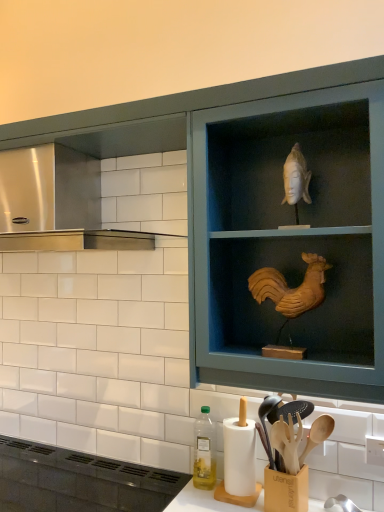
The width and height of the screenshot is (384, 512). What do you see at coordinates (80, 481) in the screenshot?
I see `matte black vent at lower left` at bounding box center [80, 481].

Where is `wooden spoons at lower center`? The height and width of the screenshot is (512, 384). wooden spoons at lower center is located at coordinates (291, 431).

Measure the distance between stainless steel vent at upper left and camera.

stainless steel vent at upper left and camera are 12.38 feet apart.

What do you see at coordinates (197, 180) in the screenshot? The height and width of the screenshot is (512, 384). I see `wooden cabinet at upper center` at bounding box center [197, 180].

You are a GUI agent. You are given a task and a screenshot of the screen. Output one action in this format:
    pyautogui.click(x=<x>, y=<y>)
    Task: Click on the translucent plastic bottle at lower center
    
    Given the screenshot: What is the action you would take?
    pyautogui.click(x=204, y=451)

Can you confirm if translucent plastic bottle at lower center is positioned to the right of wooden rooster at upper right?

Incorrect, translucent plastic bottle at lower center is not on the right side of wooden rooster at upper right.

In the scene shown: Which of these two, translucent plastic bottle at lower center or wooden rooster at upper right, is wider?

Wider between the two is wooden rooster at upper right.

Which is behind, translucent plastic bottle at lower center or wooden rooster at upper right?

translucent plastic bottle at lower center is further away from the camera.

How many degrees apart are the facing directions of translucent plastic bottle at lower center and wooden rooster at upper right?

7.53 degrees separate the facing orientations of translucent plastic bottle at lower center and wooden rooster at upper right.

Is wooden spoons at lower center beside matte black vent at lower left?

They are not placed beside each other.

Does point (299, 466) appear closer or farther from the camera than point (38, 456)?

Point (299, 466).

From a real-world perspective, is wooden spoons at lower center above or below matte black vent at lower left?

From a real-world perspective, wooden spoons at lower center is physically above matte black vent at lower left.

Can you confirm if translucent plastic bottle at lower center is bigger than wooden spoons at lower center?

No, translucent plastic bottle at lower center is not bigger than wooden spoons at lower center.

Is translucent plastic bottle at lower center at the right side of wooden spoons at lower center?

In fact, translucent plastic bottle at lower center is to the left of wooden spoons at lower center.

How much distance is there between translucent plastic bottle at lower center and wooden spoons at lower center?

A distance of 10.80 inches exists between translucent plastic bottle at lower center and wooden spoons at lower center.

From a real-world perspective, who is located higher, translucent plastic bottle at lower center or wooden spoons at lower center?

wooden spoons at lower center, from a real-world perspective.

Identify the location of shelf in front of the wooden cabinet at upper center. The image size is (384, 512). (291, 240).

From a real-world perspective, between wooden cabinet at upper center and wooden rooster at upper right, who is vertically higher?

wooden rooster at upper right.

Is wooden cabinet at upper center further to camera compared to wooden rooster at upper right?

Yes, the depth of wooden cabinet at upper center is greater than that of wooden rooster at upper right.

Can you tell me how much wooden cabinet at upper center and wooden rooster at upper right differ in facing direction?

0.602 degrees separate the facing orientations of wooden cabinet at upper center and wooden rooster at upper right.

Is wooden spoons at lower center closer to camera compared to stainless steel vent at upper left?

Yes, wooden spoons at lower center is in front of stainless steel vent at upper left.

Does wooden spoons at lower center have a smaller size compared to stainless steel vent at upper left?

Correct, wooden spoons at lower center occupies less space than stainless steel vent at upper left.

Could you tell me if wooden spoons at lower center is facing stainless steel vent at upper left?

No.

Consider the image. From a real-world perspective, between wooden spoons at lower center and stainless steel vent at upper left, who is vertically higher?

From a 3D spatial view, stainless steel vent at upper left is above.

Does stainless steel vent at upper left appear on the left side of matte black vent at lower left?

Yes.

From the image's perspective, is stainless steel vent at upper left above matte black vent at lower left?

Yes, from the image's perspective, stainless steel vent at upper left is over matte black vent at lower left.

In the scene shown: From a real-world perspective, is stainless steel vent at upper left beneath matte black vent at lower left?

No, from a real-world perspective, stainless steel vent at upper left is not under matte black vent at lower left.

Is stainless steel vent at upper left facing towards matte black vent at lower left?

No.

From the image's perspective, which is above, wooden cabinet at upper center or matte black vent at lower left?

wooden cabinet at upper center, from the image's perspective.

Who is shorter, wooden cabinet at upper center or matte black vent at lower left?

Standing shorter between the two is matte black vent at lower left.

From the picture: Does wooden cabinet at upper center appear on the left side of matte black vent at lower left?

Incorrect, wooden cabinet at upper center is not on the left side of matte black vent at lower left.

Which of these two, wooden cabinet at upper center or matte black vent at lower left, is bigger?

wooden cabinet at upper center.

Where is `shelf to the right of translucent plastic bottle at lower center`? This screenshot has width=384, height=512. shelf to the right of translucent plastic bottle at lower center is located at coordinates (291, 240).

Where is `appliance located in front of the wooden spoons at lower center`? The height and width of the screenshot is (512, 384). appliance located in front of the wooden spoons at lower center is located at coordinates [x=80, y=481].

Estimate the real-world distances between objects in this image. Which object is further from matte black vent at lower left, wooden spoons at lower center or stainless steel vent at upper left?

stainless steel vent at upper left.

Which object lies further to the anchor point wooden cabinet at upper center, wooden spoons at lower center or wooden rooster at upper right?

wooden spoons at lower center lies further to wooden cabinet at upper center than the other object.

Considering their positions, is translucent plastic bottle at lower center positioned closer to matte black vent at lower left than stainless steel vent at upper left?

translucent plastic bottle at lower center.

Which object lies further to the anchor point wooden cabinet at upper center, translucent plastic bottle at lower center or stainless steel vent at upper left?

stainless steel vent at upper left lies further to wooden cabinet at upper center than the other object.

When comparing their distances from wooden rooster at upper right, does wooden cabinet at upper center or wooden spoons at lower center seem closer?

Among the two, wooden cabinet at upper center is located nearer to wooden rooster at upper right.

Which object lies nearer to the anchor point wooden cabinet at upper center, wooden spoons at lower center or matte black vent at lower left?

wooden spoons at lower center.

Looking at the image, which one is located further to wooden spoons at lower center, stainless steel vent at upper left or translucent plastic bottle at lower center?

stainless steel vent at upper left lies further to wooden spoons at lower center than the other object.

Estimate the real-world distances between objects in this image. Which object is further from stainless steel vent at upper left, matte black vent at lower left or wooden spoons at lower center?

Based on the image, wooden spoons at lower center appears to be further to stainless steel vent at upper left.

The height and width of the screenshot is (512, 384). Find the location of `shelf between stainless steel vent at upper left and wooden spoons at lower center from left to right`. shelf between stainless steel vent at upper left and wooden spoons at lower center from left to right is located at coordinates (291, 240).

Identify the location of cabinetry between matte black vent at lower left and wooden spoons at lower center from left to right. (197, 180).

In order to click on bottle between wooden rooster at upper right and matte black vent at lower left vertically in this screenshot , I will do `click(204, 451)`.

The width and height of the screenshot is (384, 512). In order to click on cabinetry between wooden rooster at upper right and translucent plastic bottle at lower center in the vertical direction in this screenshot , I will do `click(197, 180)`.